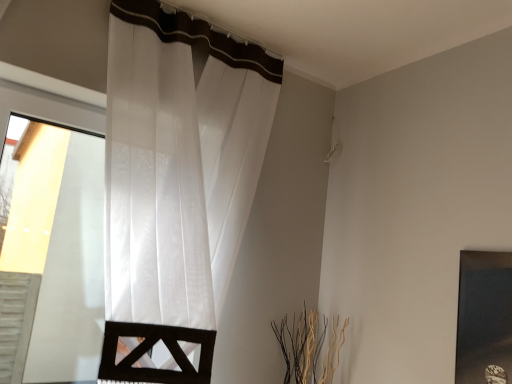
Question: Is white sheer curtain at left inside matte black picture frame at right?

Choices:
 (A) no
 (B) yes

Answer: (A)

Question: Is matte black picture frame at right not inside white sheer curtain at left?

Choices:
 (A) yes
 (B) no

Answer: (A)

Question: From the image's perspective, is matte black picture frame at right located beneath white sheer curtain at left?

Choices:
 (A) no
 (B) yes

Answer: (B)

Question: Is matte black picture frame at right at the right side of white sheer curtain at left?

Choices:
 (A) no
 (B) yes

Answer: (B)

Question: Considering the relative sizes of matte black picture frame at right and white sheer curtain at left in the image provided, is matte black picture frame at right taller than white sheer curtain at left?

Choices:
 (A) yes
 (B) no

Answer: (B)

Question: Does matte black picture frame at right have a lesser width compared to white sheer curtain at left?

Choices:
 (A) no
 (B) yes

Answer: (B)

Question: Can you confirm if white sheer curtain at left is positioned to the right of matte black picture frame at right?

Choices:
 (A) yes
 (B) no

Answer: (B)

Question: From the image's perspective, does white sheer curtain at left appear lower than matte black picture frame at right?

Choices:
 (A) no
 (B) yes

Answer: (A)

Question: From a real-world perspective, is white sheer curtain at left positioned under matte black picture frame at right based on gravity?

Choices:
 (A) no
 (B) yes

Answer: (A)

Question: Does white sheer curtain at left have a greater height compared to matte black picture frame at right?

Choices:
 (A) yes
 (B) no

Answer: (A)

Question: Can you confirm if white sheer curtain at left is thinner than matte black picture frame at right?

Choices:
 (A) no
 (B) yes

Answer: (A)

Question: Does white sheer curtain at left have a greater width compared to matte black picture frame at right?

Choices:
 (A) no
 (B) yes

Answer: (B)

Question: Is point (474, 380) closer or farther from the camera than point (164, 135)?

Choices:
 (A) farther
 (B) closer

Answer: (B)